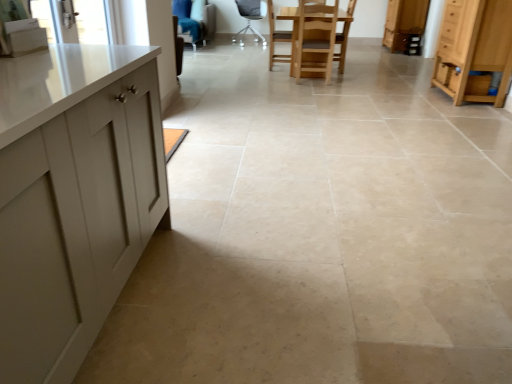
The image size is (512, 384). What do you see at coordinates (277, 39) in the screenshot? I see `wooden chair at center, which is the first chair from bottom to top` at bounding box center [277, 39].

What is the approximate height of wooden cabinet at upper right, which is the first cabinetry from back to front?

wooden cabinet at upper right, which is the first cabinetry from back to front, is 90.36 centimeters in height.

Image resolution: width=512 pixels, height=384 pixels. What do you see at coordinates (80, 21) in the screenshot?
I see `clear glass window screen at upper left` at bounding box center [80, 21].

In order to face light blue fabric armchair at upper center, arranged as the first armchair when viewed from the left, should I rotate leftwards or rightwards?

To face it directly, rotate left by 9.495 degrees.

In order to face metallic gray chair at center, the second chair positioned from the right, should I rotate leftwards or rightwards?

Turn left approximately 0.985 degrees to face it.

At what (x,y) coordinates should I click in order to perform the action: click on wooden chair at center, which appears as the 2th chair when viewed from the left. Please return your answer as a coordinate pair (x, y). Looking at the image, I should click on (277, 39).

Who is smaller, wooden chair at center, which is the 1th armchair from front to back, or clear glass window screen at upper left?

clear glass window screen at upper left is smaller.

Between wooden chair at center, which is the 1th armchair from front to back, and clear glass window screen at upper left, which one appears on the right side from the viewer's perspective?

wooden chair at center, which is the 1th armchair from front to back.

Is wooden chair at center, the first armchair viewed from the right, shorter than clear glass window screen at upper left?

No.

How far apart are wooden chair at center, which is the 1th armchair from front to back, and clear glass window screen at upper left?

3.49 meters.

Is metallic gray chair at center, the second chair positioned from the right, positioned with its back to clear glass window screen at upper left?

metallic gray chair at center, the second chair positioned from the right, is not turned away from clear glass window screen at upper left.

Is clear glass window screen at upper left located within metallic gray chair at center, the second chair positioned from the right?

Actually, clear glass window screen at upper left is outside metallic gray chair at center, the second chair positioned from the right.

From a real-world perspective, is metallic gray chair at center, the second chair positioned from the right, under clear glass window screen at upper left?

Yes, from a real-world perspective, metallic gray chair at center, the second chair positioned from the right, is below clear glass window screen at upper left.

Does light wood cabinet at right, marked as the first cabinetry in a bottom-to-top arrangement, appear on the right side of wooden chair at center, the first chair positioned from the right?

Correct, you'll find light wood cabinet at right, marked as the first cabinetry in a bottom-to-top arrangement, to the right of wooden chair at center, the first chair positioned from the right.

Based on the photo, is light wood cabinet at right, which appears as the second cabinetry when viewed from the back, thinner than wooden chair at center, which is the 2th chair from top to bottom?

Yes, light wood cabinet at right, which appears as the second cabinetry when viewed from the back, is thinner than wooden chair at center, which is the 2th chair from top to bottom.

Is light wood cabinet at right, which is counted as the 1th cabinetry, starting from the front, oriented away from wooden chair at center, which is the 2th chair from top to bottom?

No, light wood cabinet at right, which is counted as the 1th cabinetry, starting from the front,'s orientation is not away from wooden chair at center, which is the 2th chair from top to bottom.

From a real-world perspective, is light wood cabinet at right, acting as the 2th cabinetry starting from the top, on top of wooden chair at center, arranged as the first chair when viewed from the front?

Indeed, from a real-world perspective, light wood cabinet at right, acting as the 2th cabinetry starting from the top, stands above wooden chair at center, arranged as the first chair when viewed from the front.

Can you confirm if wooden cabinet at upper right, the 1th cabinetry when ordered from top to bottom, is positioned to the right of metallic gray chair at center, the 2th chair when ordered from bottom to top?

Yes.

Looking at their sizes, would you say wooden cabinet at upper right, which is the first cabinetry from back to front, is wider or thinner than metallic gray chair at center, the second chair positioned from the right?

Considering their sizes, wooden cabinet at upper right, which is the first cabinetry from back to front, looks slimmer than metallic gray chair at center, the second chair positioned from the right.

Could you tell me if wooden cabinet at upper right, which is the second cabinetry in bottom-to-top order, is facing metallic gray chair at center, the second chair viewed from the front?

Result: Yes, wooden cabinet at upper right, which is the second cabinetry in bottom-to-top order, is aimed at metallic gray chair at center, the second chair viewed from the front.

Can you confirm if wooden cabinet at upper right, the 1th cabinetry when ordered from top to bottom, is smaller than metallic gray chair at center, which is the first chair in back-to-front order?

Actually, wooden cabinet at upper right, the 1th cabinetry when ordered from top to bottom, might be larger than metallic gray chair at center, which is the first chair in back-to-front order.

Would you say wooden chair at center, which is the second armchair in back-to-front order, is part of wooden chair at center, which is the first chair from bottom to top,'s contents?

Yes, wooden chair at center, which is the second armchair in back-to-front order, can be found within wooden chair at center, which is the first chair from bottom to top.

Is wooden chair at center, which appears as the 2th chair when viewed from the left, at the left side of wooden chair at center, which appears as the second armchair when viewed from the left?

In fact, wooden chair at center, which appears as the 2th chair when viewed from the left, is to the right of wooden chair at center, which appears as the second armchair when viewed from the left.

Is wooden chair at center, which appears as the 2th chair when viewed from the left, facing away from wooden chair at center, which appears as the second armchair when viewed from the left?

Yes, wooden chair at center, which appears as the 2th chair when viewed from the left, is facing away from wooden chair at center, which appears as the second armchair when viewed from the left.

Can you tell me how much wooden chair at center, arranged as the first chair when viewed from the front, and wooden chair at center, the first armchair viewed from the right, differ in facing direction?

wooden chair at center, arranged as the first chair when viewed from the front, and wooden chair at center, the first armchair viewed from the right, are facing 179 degrees away from each other.

Who is taller, wooden cabinet at upper right, the 2th cabinetry from the front, or light blue fabric armchair at upper center, marked as the 2th armchair in a right-to-left arrangement?

wooden cabinet at upper right, the 2th cabinetry from the front, is taller.

Based on their sizes in the image, would you say wooden cabinet at upper right, the 2th cabinetry from the front, is bigger or smaller than light blue fabric armchair at upper center, which is the second armchair in front-to-back order?

In the image, wooden cabinet at upper right, the 2th cabinetry from the front, appears to be smaller than light blue fabric armchair at upper center, which is the second armchair in front-to-back order.

You are a GUI agent. You are given a task and a screenshot of the screen. Output one action in this format:
    pyautogui.click(x=<x>, y=<y>)
    Task: Click on the armchair above the wooden cabinet at upper right, which is the first cabinetry from back to front (from the image's perspective)
    Image resolution: width=512 pixels, height=384 pixels.
    Given the screenshot: What is the action you would take?
    pyautogui.click(x=198, y=24)

Is wooden cabinet at upper right, the 2th cabinetry from the front, far from clear glass window screen at upper left?

Yes, wooden cabinet at upper right, the 2th cabinetry from the front, and clear glass window screen at upper left are quite far apart.

Which object is further away from the camera, wooden cabinet at upper right, the 2th cabinetry from the front, or clear glass window screen at upper left?

wooden cabinet at upper right, the 2th cabinetry from the front, is further away from the camera.

Consider the image. Does wooden cabinet at upper right, which is the second cabinetry in bottom-to-top order, have a smaller size compared to clear glass window screen at upper left?

No.

Considering the relative sizes of wooden cabinet at upper right, which is the first cabinetry from back to front, and clear glass window screen at upper left in the image provided, is wooden cabinet at upper right, which is the first cabinetry from back to front, taller than clear glass window screen at upper left?

Yes.

Locate an element on the screen. armchair that appears on the right of clear glass window screen at upper left is located at coordinates (276, 38).

The height and width of the screenshot is (384, 512). Find the location of `window screen that appears above the metallic gray chair at center, the first chair positioned from the left (from a real-world perspective)`. window screen that appears above the metallic gray chair at center, the first chair positioned from the left (from a real-world perspective) is located at coordinates (80, 21).

From the image, which object appears to be nearer to wooden chair at center, the first chair positioned from the right, light wood cabinet at right, which appears as the second cabinetry when viewed from the back, or wooden cabinet at upper right, which is the second cabinetry in bottom-to-top order?

Among the two, light wood cabinet at right, which appears as the second cabinetry when viewed from the back, is located nearer to wooden chair at center, the first chair positioned from the right.

Estimate the real-world distances between objects in this image. Which object is further from light wood cabinet at right, which appears as the second cabinetry when viewed from the back, wooden cabinet at upper right, which is the first cabinetry from back to front, or metallic gray chair at center, which is the first chair in back-to-front order?

metallic gray chair at center, which is the first chair in back-to-front order, is further to light wood cabinet at right, which appears as the second cabinetry when viewed from the back.

From the image, which object appears to be nearer to light blue fabric armchair at upper center, arranged as the 1th armchair when viewed from the back, light wood cabinet at right, which appears as the second cabinetry when viewed from the back, or wooden cabinet at upper right, which is the second cabinetry in bottom-to-top order?

Among the two, wooden cabinet at upper right, which is the second cabinetry in bottom-to-top order, is located nearer to light blue fabric armchair at upper center, arranged as the 1th armchair when viewed from the back.

When comparing their distances from wooden chair at center, which is the second armchair in back-to-front order, does light blue fabric armchair at upper center, arranged as the first armchair when viewed from the left, or clear glass window screen at upper left seem further?

clear glass window screen at upper left.

Estimate the real-world distances between objects in this image. Which object is closer to light wood cabinet at right, which is counted as the 1th cabinetry, starting from the front, wooden chair at center, which appears as the second armchair when viewed from the left, or metallic gray chair at center, which is the first chair in back-to-front order?

Based on the image, wooden chair at center, which appears as the second armchair when viewed from the left, appears to be nearer to light wood cabinet at right, which is counted as the 1th cabinetry, starting from the front.

When comparing their distances from metallic gray chair at center, the second chair viewed from the front, does clear glass window screen at upper left or wooden chair at center, the first armchair viewed from the right, seem closer?

Based on the image, wooden chair at center, the first armchair viewed from the right, appears to be nearer to metallic gray chair at center, the second chair viewed from the front.

Considering their positions, is wooden chair at center, arranged as the second chair when viewed from the back, positioned closer to wooden cabinet at upper right, which is the second cabinetry in bottom-to-top order, than wooden chair at center, which is the second armchair in back-to-front order?

wooden chair at center, arranged as the second chair when viewed from the back, is closer to wooden cabinet at upper right, which is the second cabinetry in bottom-to-top order.

Considering their positions, is wooden chair at center, which is the 2th chair from top to bottom, positioned further to light wood cabinet at right, which appears as the second cabinetry when viewed from the back, than light blue fabric armchair at upper center, marked as the 2th armchair in a right-to-left arrangement?

light blue fabric armchair at upper center, marked as the 2th armchair in a right-to-left arrangement, is further to light wood cabinet at right, which appears as the second cabinetry when viewed from the back.

Where is `armchair between metallic gray chair at center, the 2th chair when ordered from bottom to top, and wooden cabinet at upper right, the 2th cabinetry from the front, from left to right`? This screenshot has width=512, height=384. armchair between metallic gray chair at center, the 2th chair when ordered from bottom to top, and wooden cabinet at upper right, the 2th cabinetry from the front, from left to right is located at coordinates (276, 38).

This screenshot has height=384, width=512. Identify the location of armchair located between light blue fabric armchair at upper center, arranged as the first armchair when viewed from the left, and wooden cabinet at upper right, which is the first cabinetry from back to front, in the left-right direction. (276, 38).

Locate an element on the screen. This screenshot has height=384, width=512. armchair between clear glass window screen at upper left and light blue fabric armchair at upper center, arranged as the first armchair when viewed from the left, along the z-axis is located at coordinates (276, 38).

The width and height of the screenshot is (512, 384). I want to click on cabinetry located between clear glass window screen at upper left and wooden cabinet at upper right, which is the second cabinetry in bottom-to-top order, in the depth direction, so click(x=474, y=50).